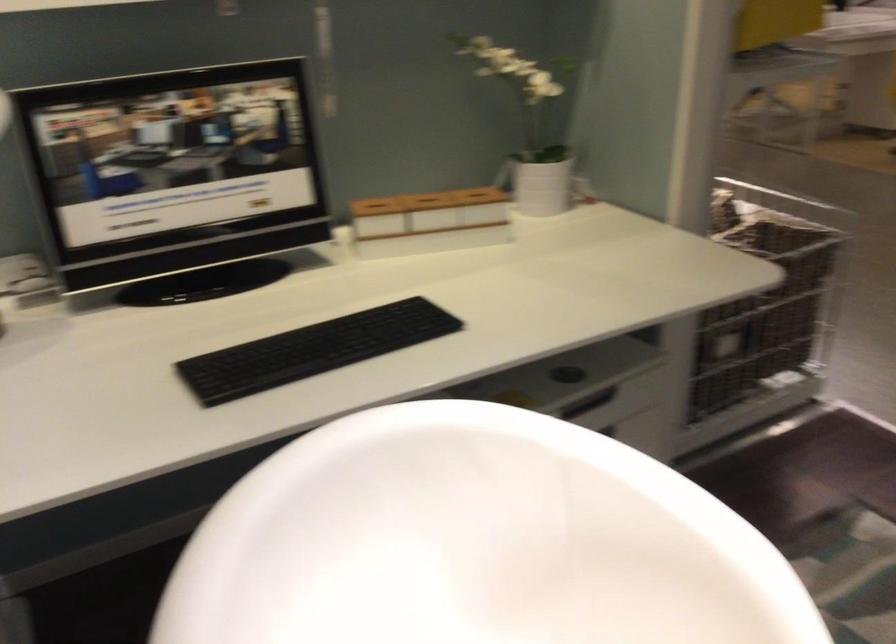
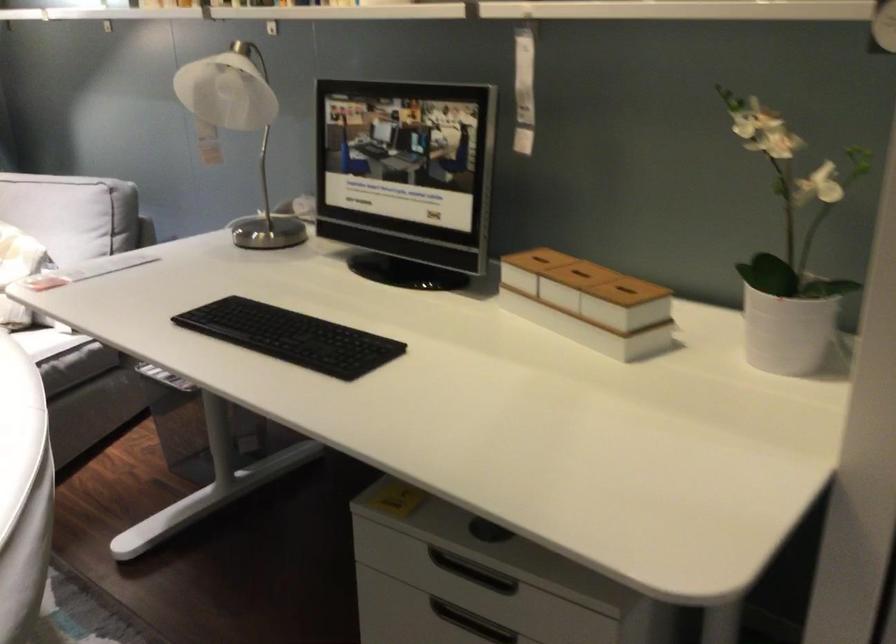
In the second image, find the point that corresponds to point 494,193 in the first image.

(627, 290)